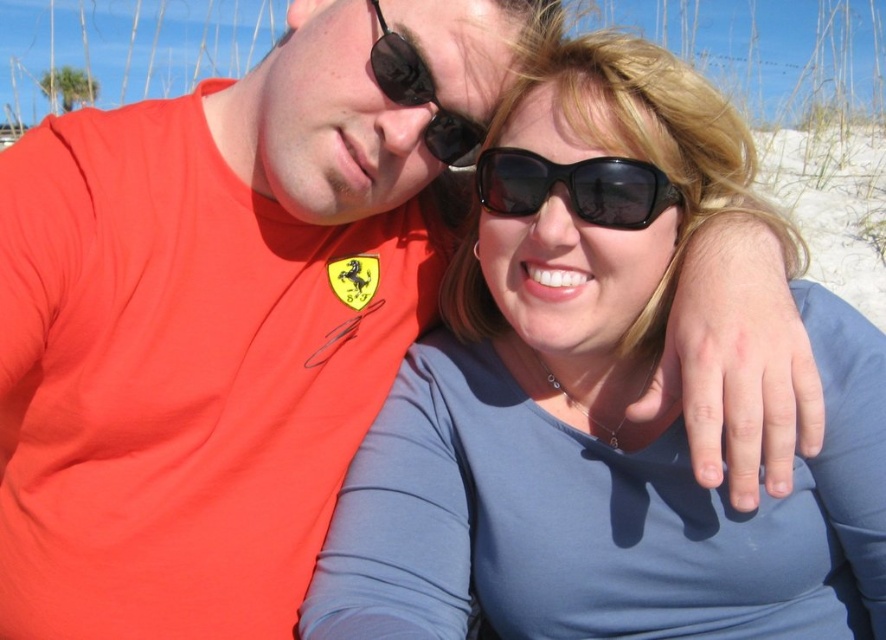
Looking at this image, does matte blue shirt at center have a greater height compared to black plastic sunglasses at center?

Yes.

Does point (630, 88) come farther from viewer compared to point (579, 193)?

Yes, point (630, 88) is behind point (579, 193).

This screenshot has height=640, width=886. I want to click on matte blue shirt at center, so (x=597, y=403).

Find the location of a particular element. matte blue shirt at center is located at coordinates (597, 403).

Is black plastic sunglasses at center positioned behind black rubber sunglasses at upper center?

No, it is not.

Find the location of `black plastic sunglasses at center`. black plastic sunglasses at center is located at coordinates (574, 186).

Is point (634, 38) closer to viewer compared to point (445, 160)?

Yes.

Does matte blue shirt at center appear on the left side of black rubber sunglasses at upper center?

In fact, matte blue shirt at center is to the right of black rubber sunglasses at upper center.

Who is more forward, (434, 394) or (434, 124)?

Point (434, 124) is in front.

You are a GUI agent. You are given a task and a screenshot of the screen. Output one action in this format:
    pyautogui.click(x=<x>, y=<y>)
    Task: Click on the matte blue shirt at center
    
    Given the screenshot: What is the action you would take?
    pyautogui.click(x=597, y=403)